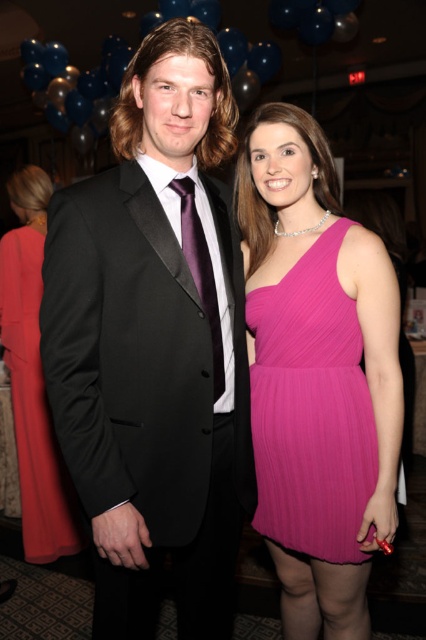
Question: Which point is closer to the camera taking this photo?

Choices:
 (A) (100, 484)
 (B) (327, 340)
 (C) (28, 499)

Answer: (A)

Question: Can you confirm if black satin suit at center is positioned to the left of purple satin tie at center?

Choices:
 (A) yes
 (B) no

Answer: (A)

Question: Which of the following is the farthest from the observer?

Choices:
 (A) (34, 394)
 (B) (207, 314)
 (C) (347, 516)
 (D) (172, 83)

Answer: (A)

Question: Can you confirm if pink pleated dress at center is positioned below silky red dress at center?

Choices:
 (A) no
 (B) yes

Answer: (A)

Question: Is pink pleated dress at center above purple satin tie at center?

Choices:
 (A) yes
 (B) no

Answer: (B)

Question: Which of these objects is positioned closest to the black satin suit at center?

Choices:
 (A) purple satin tie at center
 (B) silky red dress at center

Answer: (A)